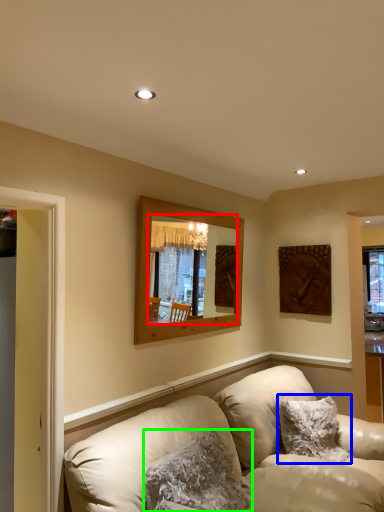
Question: Estimate the real-world distances between objects in this image. Which object is farther from mirror (highlighted by a red box), pillow (highlighted by a blue box) or pillow (highlighted by a green box)?

Choices:
 (A) pillow
 (B) pillow

Answer: (B)